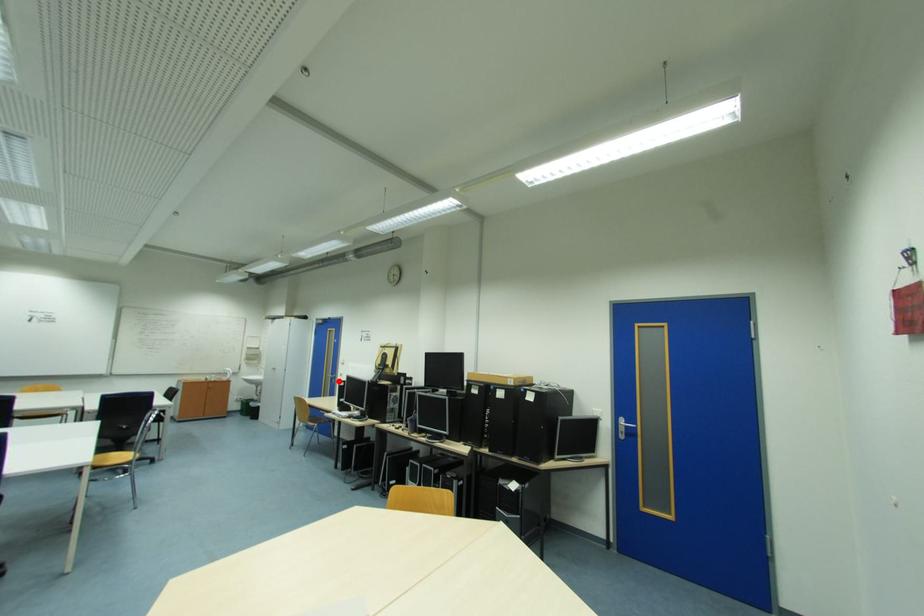
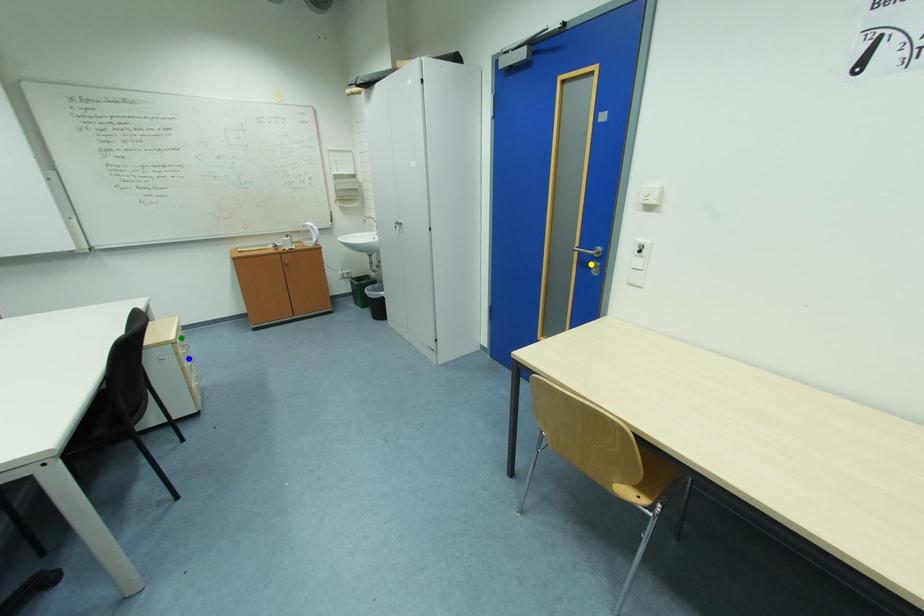
Question: I am providing you with two images of the same scene from different viewpoints. A red point is marked on the first image. You are given multiple points on the second image. Which point in image 2 is actually the same real-world point as the red point in image 1?

Choices:
 (A) yellow point
 (B) green point
 (C) blue point

Answer: (A)